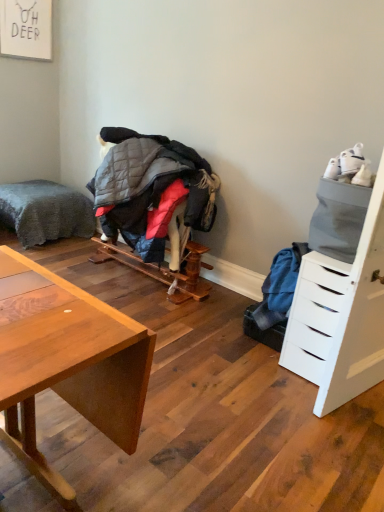
Measure the distance between point (327, 306) and camera.

Point (327, 306) is 7.31 feet from camera.

Where is `white matte drawer at right`? The width and height of the screenshot is (384, 512). white matte drawer at right is located at coordinates (314, 315).

At what (x,y) coordinates should I click in order to perform the action: click on quilted gray jacket at center. Please return your answer as a coordinate pair (x, y). This screenshot has width=384, height=512. Looking at the image, I should click on (152, 191).

Relative to quilted gray jacket at center, is white matte drawer at right in front or behind?

Clearly, white matte drawer at right is in front of quilted gray jacket at center.

Locate an element on the screen. The width and height of the screenshot is (384, 512). drawer below the quilted gray jacket at center (from a real-world perspective) is located at coordinates (314, 315).

Can quilted gray jacket at center be found inside white matte drawer at right?

No, quilted gray jacket at center is not inside white matte drawer at right.

From a real-world perspective, relative to quilted gray jacket at center, is white matte drawer at right vertically above or below?

In terms of real-world spatial position, white matte drawer at right is below quilted gray jacket at center.

Considering the sizes of gray plush bed at left and quilted gray jacket at center in the image, is gray plush bed at left wider or thinner than quilted gray jacket at center?

In the image, gray plush bed at left appears to be wider than quilted gray jacket at center.

Is gray plush bed at left next to quilted gray jacket at center?

There is a gap between gray plush bed at left and quilted gray jacket at center.

Does gray plush bed at left turn towards quilted gray jacket at center?

No.

From the image's perspective, between gray plush bed at left and quilted gray jacket at center, which one is located above?

gray plush bed at left is shown above in the image.

Is white matte drawer at right inside quilted gray jacket at center?

No, white matte drawer at right is located outside of quilted gray jacket at center.

From a real-world perspective, relative to white matte drawer at right, is quilted gray jacket at center vertically above or below?

From a real-world perspective, quilted gray jacket at center is physically above white matte drawer at right.

Looking at this image, which of these two, quilted gray jacket at center or white matte drawer at right, is smaller?

quilted gray jacket at center is smaller.

Is quilted gray jacket at center positioned behind gray plush bed at left?

No, it is in front of gray plush bed at left.

Locate an element on the screen. The image size is (384, 512). bed that appears behind the quilted gray jacket at center is located at coordinates (45, 212).

From a real-world perspective, which object stands above the other?

quilted gray jacket at center is physically above.

From the image's perspective, between quilted gray jacket at center and gray plush bed at left, which one is located above?

gray plush bed at left is shown above in the image.

Looking at this image, is gray plush bed at left bigger than white matte drawer at right?

Yes.

From the image's perspective, who appears lower, gray plush bed at left or white matte drawer at right?

white matte drawer at right.

Considering the sizes of gray plush bed at left and white matte drawer at right in the image, is gray plush bed at left taller or shorter than white matte drawer at right?

In the image, gray plush bed at left appears to be shorter than white matte drawer at right.

Does white matte drawer at right appear on the left side of gray plush bed at left?

Incorrect, white matte drawer at right is not on the left side of gray plush bed at left.

Relative to gray plush bed at left, is white matte drawer at right in front or behind?

white matte drawer at right is positioned closer to the viewer than gray plush bed at left.

Would you say white matte drawer at right is outside gray plush bed at left?

Yes, white matte drawer at right is outside of gray plush bed at left.

Considering the positions of points (316, 286) and (44, 215), is point (316, 286) farther from camera compared to point (44, 215)?

No, (316, 286) is in front of (44, 215).

At what (x,y) coordinates should I click in order to perform the action: click on drawer located in front of the quilted gray jacket at center. Please return your answer as a coordinate pair (x, y). The width and height of the screenshot is (384, 512). Looking at the image, I should click on (314, 315).

In order to click on bed above the quilted gray jacket at center (from the image's perspective) in this screenshot , I will do `click(45, 212)`.

Looking at the image, which one is located further to white matte drawer at right, quilted gray jacket at center or gray plush bed at left?

The object further to white matte drawer at right is gray plush bed at left.

Looking at the image, which one is located closer to gray plush bed at left, white matte drawer at right or quilted gray jacket at center?

quilted gray jacket at center.

Considering their positions, is quilted gray jacket at center positioned closer to gray plush bed at left than white matte drawer at right?

quilted gray jacket at center is closer to gray plush bed at left.

Which object lies further to the anchor point quilted gray jacket at center, gray plush bed at left or white matte drawer at right?

The object further to quilted gray jacket at center is white matte drawer at right.

From the image, which object appears to be nearer to quilted gray jacket at center, white matte drawer at right or gray plush bed at left?

The object closer to quilted gray jacket at center is gray plush bed at left.

Considering their positions, is gray plush bed at left positioned further to white matte drawer at right than quilted gray jacket at center?

Based on the image, gray plush bed at left appears to be further to white matte drawer at right.

This screenshot has height=512, width=384. Find the location of `clothing between gray plush bed at left and white matte drawer at right`. clothing between gray plush bed at left and white matte drawer at right is located at coordinates (152, 191).